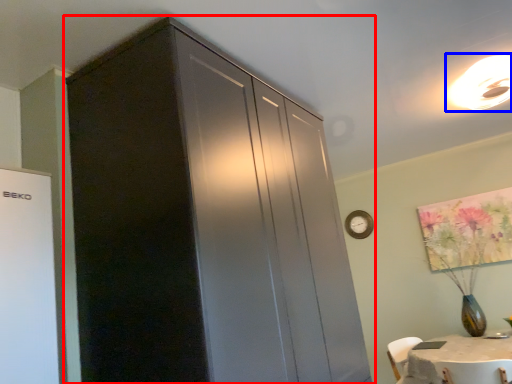
Question: Among these objects, which one is farthest to the camera, cupboard (highlighted by a red box) or light fixture (highlighted by a blue box)?

Choices:
 (A) cupboard
 (B) light fixture

Answer: (B)